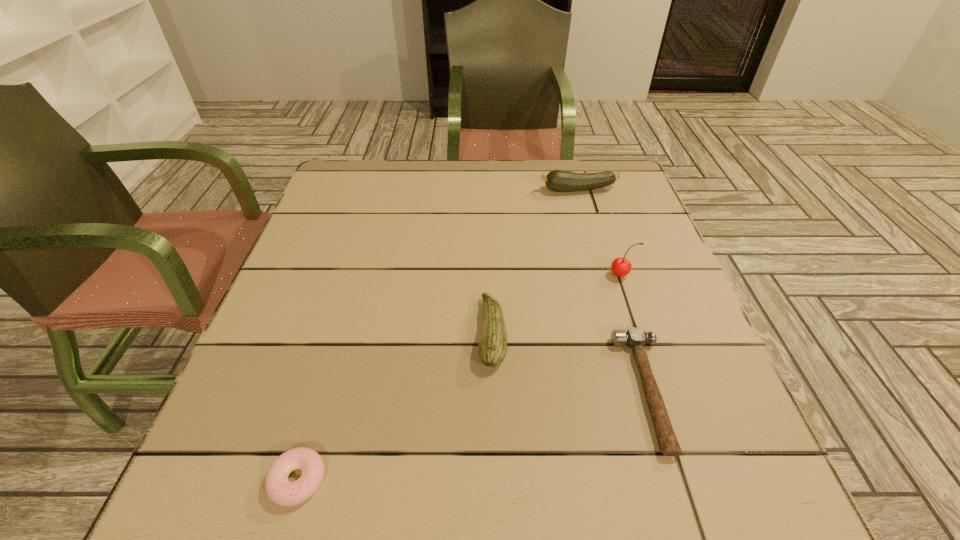
Find the location of a particular element. Image resolution: width=960 pixels, height=540 pixels. vacant space that satisfies the following two spatial constraints: 1. on the front side of the cherry; 2. at the stem end of the nearer zucchini is located at coordinates (641, 333).